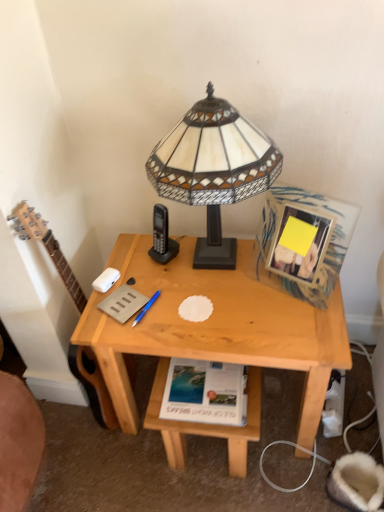
Question: Could you tell me if white paper at lower center, marked as the 2th paperback book in a top-to-bottom arrangement, is facing wooden picture frame at upper right?

Choices:
 (A) yes
 (B) no

Answer: (B)

Question: From the image's perspective, is white paper at lower center, marked as the 2th paperback book in a top-to-bottom arrangement, under wooden picture frame at upper right?

Choices:
 (A) no
 (B) yes

Answer: (B)

Question: Is white paper at lower center, the first paperback book positioned from the bottom, touching wooden picture frame at upper right?

Choices:
 (A) yes
 (B) no

Answer: (B)

Question: Is white paper at lower center, the first paperback book positioned from the bottom, smaller than wooden picture frame at upper right?

Choices:
 (A) no
 (B) yes

Answer: (B)

Question: From the image's perspective, does white paper at lower center, the 2th paperback book viewed from the left, appear higher than wooden picture frame at upper right?

Choices:
 (A) yes
 (B) no

Answer: (B)

Question: Considering the positions of point (223, 135) and point (256, 372), is point (223, 135) closer or farther from the camera than point (256, 372)?

Choices:
 (A) farther
 (B) closer

Answer: (B)

Question: From the image's perspective, is stained glass lampshade at center positioned above or below natural wood table at lower center?

Choices:
 (A) below
 (B) above

Answer: (B)

Question: Considering their positions, is stained glass lampshade at center located in front of or behind natural wood table at lower center?

Choices:
 (A) behind
 (B) front

Answer: (B)

Question: Is stained glass lampshade at center taller or shorter than natural wood table at lower center?

Choices:
 (A) tall
 (B) short

Answer: (A)

Question: Considering the positions of white paper at lower center, the first paperback book positioned from the bottom, and stained glass lampshade at center in the image, is white paper at lower center, the first paperback book positioned from the bottom, taller or shorter than stained glass lampshade at center?

Choices:
 (A) short
 (B) tall

Answer: (A)

Question: In terms of width, does white paper at lower center, the first paperback book in the right-to-left sequence, look wider or thinner when compared to stained glass lampshade at center?

Choices:
 (A) wide
 (B) thin

Answer: (B)

Question: Is white paper at lower center, the first paperback book positioned from the bottom, spatially inside stained glass lampshade at center, or outside of it?

Choices:
 (A) outside
 (B) inside

Answer: (A)

Question: From a real-world perspective, is white paper at lower center, the 2th paperback book viewed from the left, positioned above or below stained glass lampshade at center?

Choices:
 (A) above
 (B) below

Answer: (B)

Question: From the image's perspective, is natural wood table at lower center positioned above or below wooden picture frame at upper right?

Choices:
 (A) above
 (B) below

Answer: (B)

Question: Is natural wood table at lower center in front of or behind wooden picture frame at upper right in the image?

Choices:
 (A) behind
 (B) front

Answer: (A)